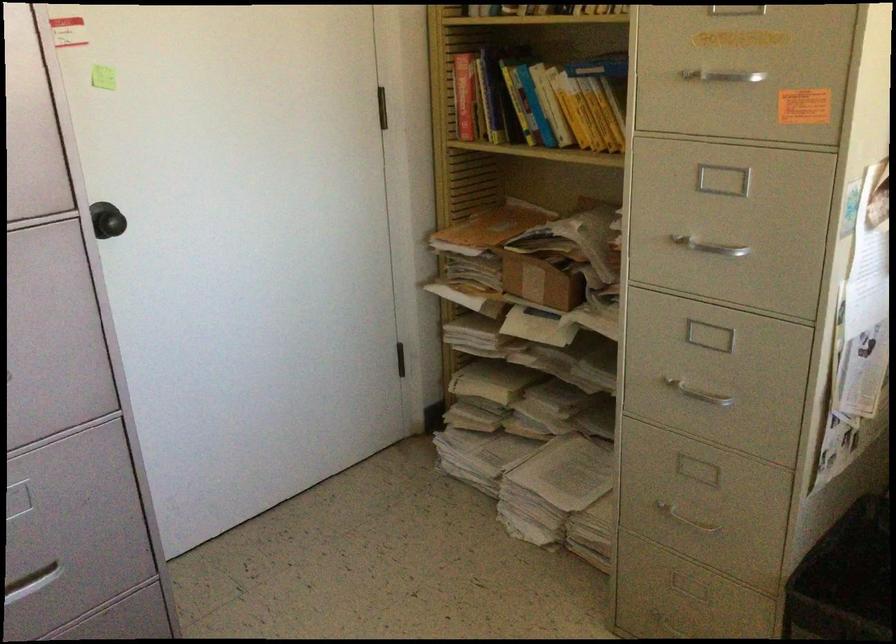
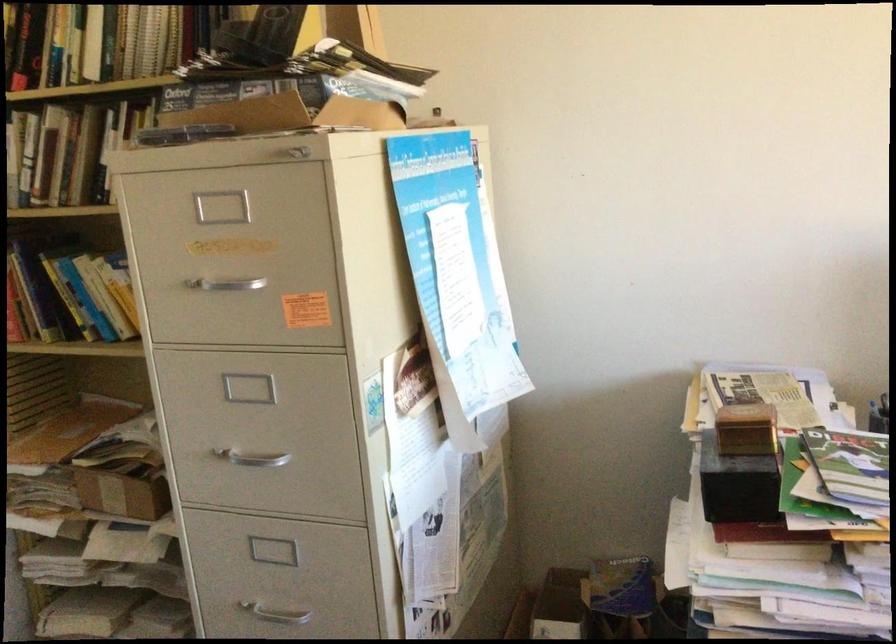
In the second image, find the point that corresponds to point 489,102 in the first image.

(27, 301)